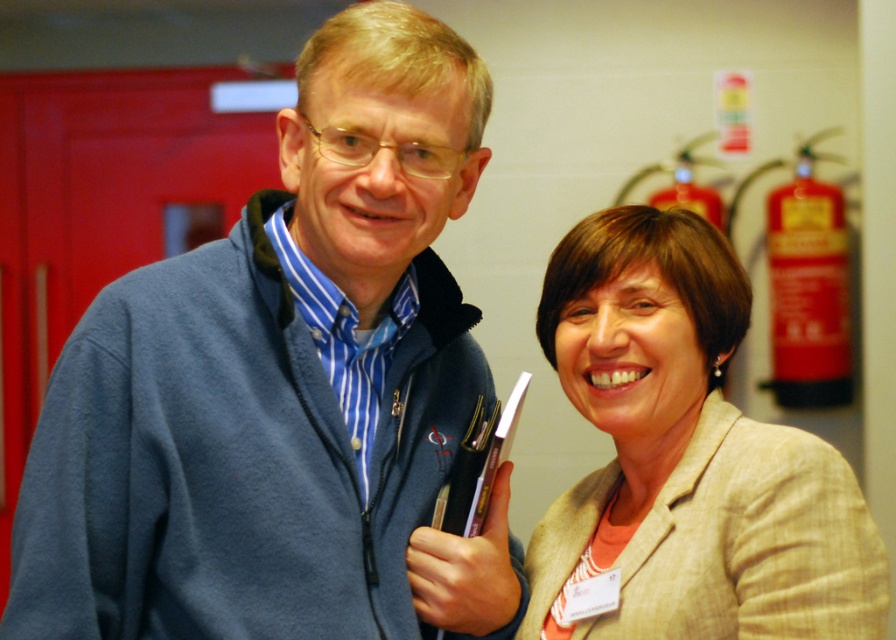
Between point (472, 394) and point (731, 420), which one is positioned in front?

Point (731, 420) is in front.

You are a GUI agent. You are given a task and a screenshot of the screen. Output one action in this format:
    pyautogui.click(x=<x>, y=<y>)
    Task: Click on the blue fleece jacket at left
    
    Given the screenshot: What is the action you would take?
    pyautogui.click(x=283, y=388)

This screenshot has height=640, width=896. I want to click on blue fleece jacket at left, so click(283, 388).